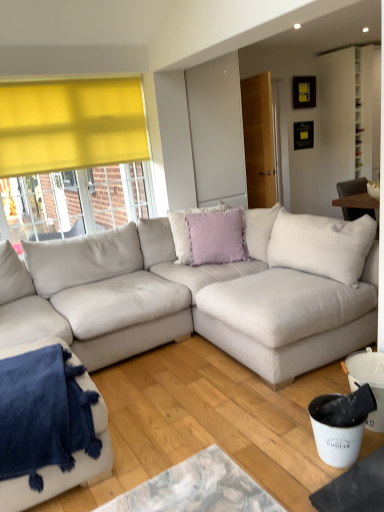
Question: Does suede-like beige couch at center, acting as the first studio couch starting from the right, lie in front of velvety blue blanket at lower left, which is the 2th studio couch in right-to-left order?

Choices:
 (A) no
 (B) yes

Answer: (B)

Question: From the image's perspective, is suede-like beige couch at center, acting as the first studio couch starting from the right, located beneath velvety blue blanket at lower left, which is the 2th studio couch in right-to-left order?

Choices:
 (A) yes
 (B) no

Answer: (B)

Question: Is suede-like beige couch at center, acting as the first studio couch starting from the right, facing away from velvety blue blanket at lower left, which is the 2th studio couch in right-to-left order?

Choices:
 (A) yes
 (B) no

Answer: (B)

Question: From the image's perspective, is suede-like beige couch at center, acting as the first studio couch starting from the right, on velvety blue blanket at lower left, which is the 2th studio couch in right-to-left order?

Choices:
 (A) yes
 (B) no

Answer: (A)

Question: Does suede-like beige couch at center, acting as the first studio couch starting from the right, have a smaller size compared to velvety blue blanket at lower left, which is the 2th studio couch in right-to-left order?

Choices:
 (A) yes
 (B) no

Answer: (B)

Question: Does suede-like beige couch at center, the second studio couch from the left, turn towards velvety blue blanket at lower left, which ranks as the 1th studio couch in left-to-right order?

Choices:
 (A) yes
 (B) no

Answer: (A)

Question: Is there a large distance between suede-like beige couch at center, the second studio couch from the left, and lavender velvet pillow at center, which ranks as the second pillow in front-to-back order?

Choices:
 (A) no
 (B) yes

Answer: (A)

Question: Is suede-like beige couch at center, acting as the first studio couch starting from the right, located outside lavender velvet pillow at center, which ranks as the second pillow in front-to-back order?

Choices:
 (A) no
 (B) yes

Answer: (B)

Question: Is suede-like beige couch at center, acting as the first studio couch starting from the right, wider than lavender velvet pillow at center, marked as the 1th pillow in a back-to-front arrangement?

Choices:
 (A) yes
 (B) no

Answer: (A)

Question: Does suede-like beige couch at center, the second studio couch from the left, have a lesser width compared to lavender velvet pillow at center, marked as the 1th pillow in a back-to-front arrangement?

Choices:
 (A) yes
 (B) no

Answer: (B)

Question: Is suede-like beige couch at center, acting as the first studio couch starting from the right, closer to camera compared to lavender velvet pillow at center, marked as the 1th pillow in a back-to-front arrangement?

Choices:
 (A) no
 (B) yes

Answer: (B)

Question: From a real-world perspective, is suede-like beige couch at center, acting as the first studio couch starting from the right, on lavender velvet pillow at center, marked as the 1th pillow in a back-to-front arrangement?

Choices:
 (A) yes
 (B) no

Answer: (B)

Question: Is lavender velvet cushion at center, the first pillow in the front-to-back sequence, directly adjacent to velvety blue blanket at lower left, which ranks as the 1th studio couch in left-to-right order?

Choices:
 (A) yes
 (B) no

Answer: (B)